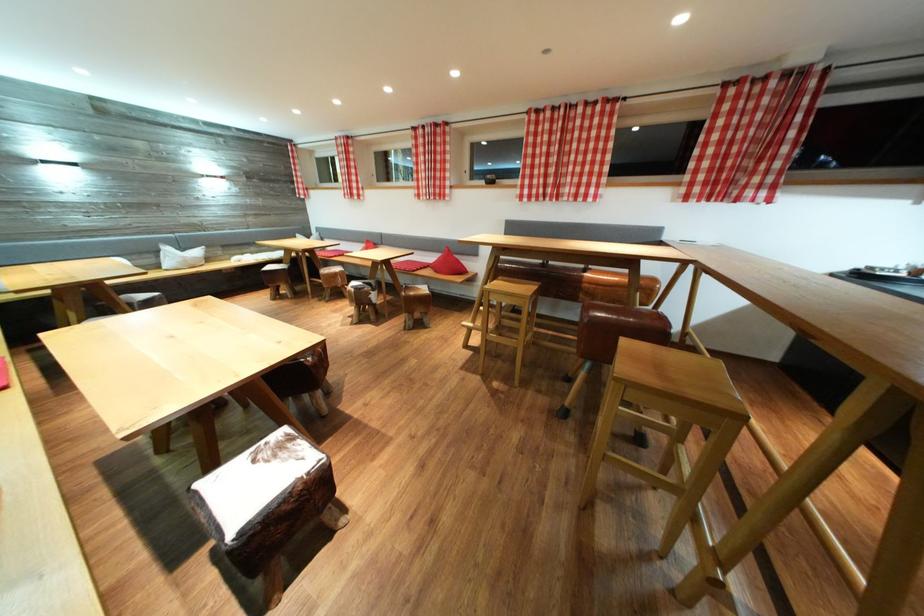
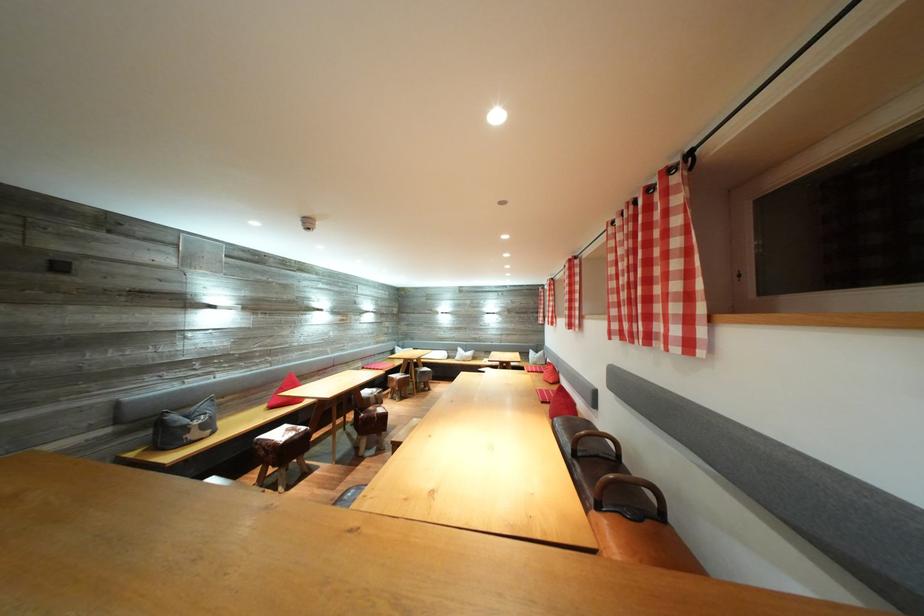
The point at (176, 254) is marked in the first image. Where is the corresponding point in the second image?

(467, 355)